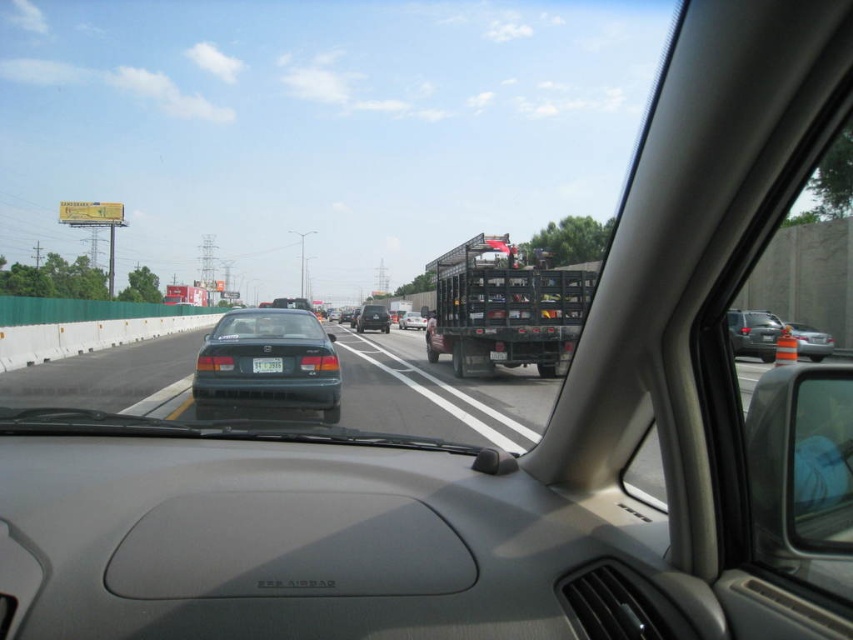
Question: Is the position of transparent blue windshield at lower right less distant than that of satin silver sedan at right?

Choices:
 (A) yes
 (B) no

Answer: (A)

Question: In this image, where is matte black sedan at center located relative to white plastic license plate at center?

Choices:
 (A) left
 (B) right

Answer: (A)

Question: Based on their relative distances, which object is farther from the white plastic license plate at center?

Choices:
 (A) metallic black trailer truck at center
 (B) matte black sedan at center

Answer: (B)

Question: Which object appears farthest from the camera in this image?

Choices:
 (A) glossy dark green sedan at center
 (B) satin silver sedan at right
 (C) matte black sedan at center

Answer: (C)

Question: Among these points, which one is nearest to the camera?

Choices:
 (A) (412, 316)
 (B) (772, 326)
 (C) (360, 320)
 (D) (294, 396)

Answer: (D)

Question: Does white plastic license plate at center have a lesser width compared to green matte sedan at center?

Choices:
 (A) no
 (B) yes

Answer: (B)